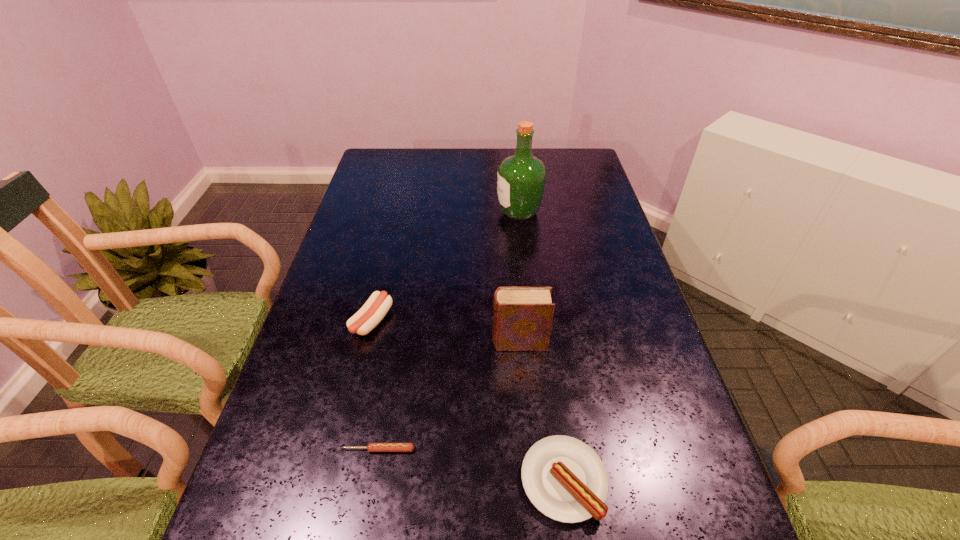
Locate an element on the screen. Image resolution: width=960 pixels, height=540 pixels. free space between the second shortest object and the diary is located at coordinates (541, 411).

This screenshot has height=540, width=960. In order to click on the second closest object to the tallest sausage in this screenshot , I will do `click(371, 447)`.

Identify which object is located as the fourth nearest to the third tallest object. Please provide its 2D coordinates. Your answer should be formatted as a tuple, i.e. [(x, y)], where the tuple contains the x and y coordinates of a point satisfying the conditions above.

[(521, 177)]

Locate an element on the screen. This screenshot has width=960, height=540. sausage that stands as the closest to the liquor is located at coordinates (376, 307).

Locate which sausage ranks second in proximity to the second tallest sausage. Please provide its 2D coordinates. Your answer should be formatted as a tuple, i.e. [(x, y)], where the tuple contains the x and y coordinates of a point satisfying the conditions above.

[(376, 307)]

In order to click on vacant point that satisfies the following two spatial constraints: 1. on the front side of the farthest sausage; 2. on the right side of the shortest sausage in this screenshot , I will do `click(342, 449)`.

Locate an element on the screen. free spot that satisfies the following two spatial constraints: 1. on the front-facing side of the liquor; 2. on the front side of the farthest sausage is located at coordinates (532, 321).

Locate an element on the screen. The image size is (960, 540). free space that satisfies the following two spatial constraints: 1. on the spine side of the fourth shortest object; 2. on the left side of the second shortest object is located at coordinates (530, 480).

Locate an element on the screen. This screenshot has width=960, height=540. blank space that satisfies the following two spatial constraints: 1. on the spine side of the fourth shortest object; 2. on the back side of the rightmost sausage is located at coordinates tap(530, 480).

Locate an element on the screen. vacant region that satisfies the following two spatial constraints: 1. on the front side of the shortest object; 2. on the right side of the third shortest object is located at coordinates (342, 449).